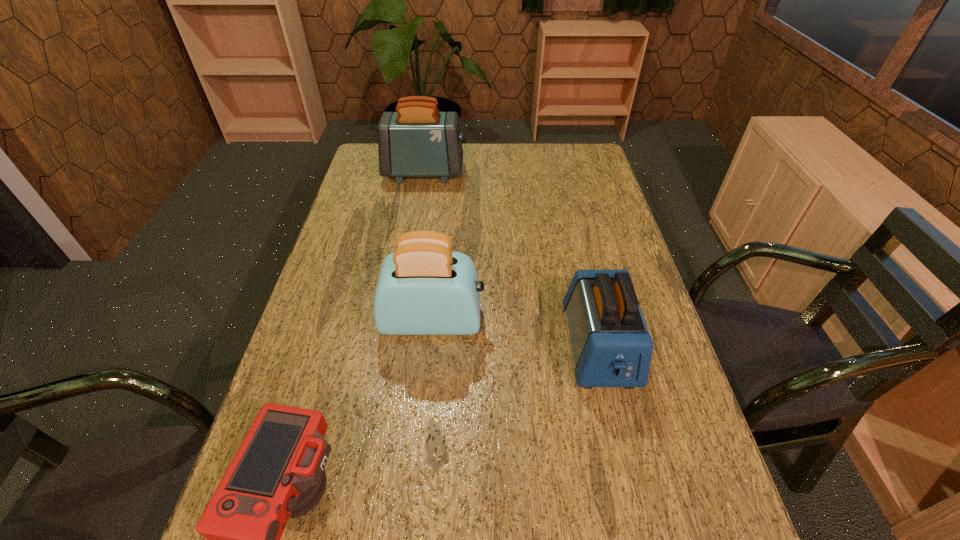
This screenshot has width=960, height=540. What are the coordinates of `the farthest toaster` in the screenshot? It's located at (417, 140).

Locate an element on the screen. The height and width of the screenshot is (540, 960). the rightmost object is located at coordinates (611, 346).

The height and width of the screenshot is (540, 960). Identify the location of the third tallest object. (611, 346).

The image size is (960, 540). In order to click on free space located on the front-facing side of the farthest object in this screenshot , I will do `click(543, 173)`.

Where is `vacant area located 0.190m on the front-facing side of the rightmost toaster`? vacant area located 0.190m on the front-facing side of the rightmost toaster is located at coordinates (631, 485).

This screenshot has height=540, width=960. Identify the location of object that is at the far edge. (417, 140).

Find the location of `object present at the left edge`. object present at the left edge is located at coordinates (417, 140).

You are a GUI agent. You are given a task and a screenshot of the screen. Output one action in this format:
    pyautogui.click(x=<x>, y=<y>)
    Task: Click on the object that is at the right edge
    This screenshot has height=540, width=960.
    Given the screenshot: What is the action you would take?
    pyautogui.click(x=611, y=346)

You are a GUI agent. You are given a task and a screenshot of the screen. Output one action in this format:
    pyautogui.click(x=<x>, y=<y>)
    Task: Click on the object located at the far left corner
    The height and width of the screenshot is (540, 960).
    Given the screenshot: What is the action you would take?
    pyautogui.click(x=417, y=140)

In the image, there is a desktop. Where is `vacant space at the far edge`? Image resolution: width=960 pixels, height=540 pixels. vacant space at the far edge is located at coordinates (546, 174).